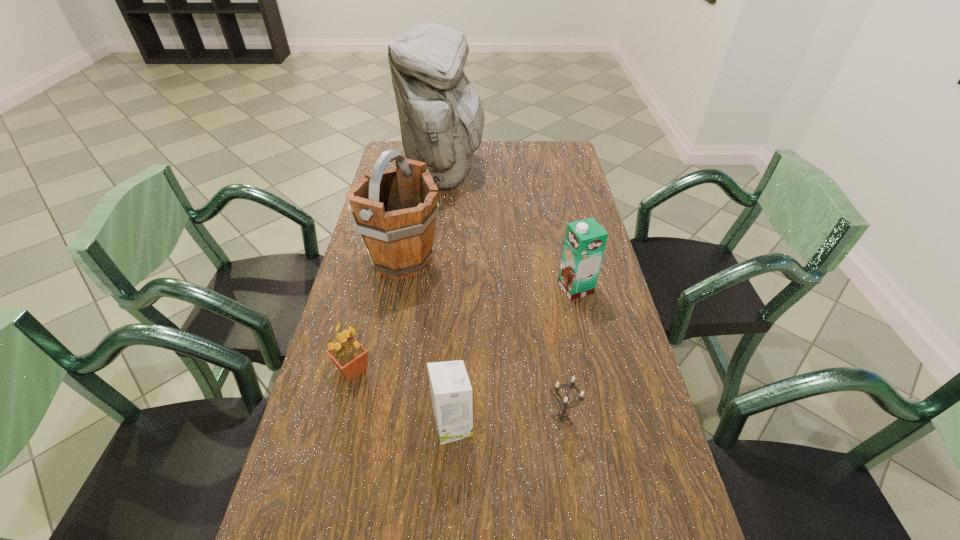
Identify the location of sunflower located in the left edge section of the desktop. (350, 357).

The image size is (960, 540). In order to click on object at the right edge in this screenshot , I will do `click(585, 240)`.

This screenshot has height=540, width=960. In order to click on object positioned at the far left corner in this screenshot , I will do `click(441, 116)`.

In the image, there is a desktop. Where is `blank space at the left edge`? The image size is (960, 540). blank space at the left edge is located at coordinates (346, 426).

The width and height of the screenshot is (960, 540). Identify the location of blank area at the right edge. (565, 226).

The height and width of the screenshot is (540, 960). What are the coordinates of `blank region between the nearer carton and the sunflower` in the screenshot? It's located at tap(403, 397).

I want to click on free space between the second tallest object and the rightmost object, so click(x=489, y=274).

Find the location of a particular element. vacant area that lies between the backpack and the shortest object is located at coordinates (504, 296).

Find the location of a particular element. The width and height of the screenshot is (960, 540). vacant space that is in between the rightmost object and the sunflower is located at coordinates (464, 329).

This screenshot has height=540, width=960. Identify the location of free area in between the fifth tallest object and the rightmost object. (464, 329).